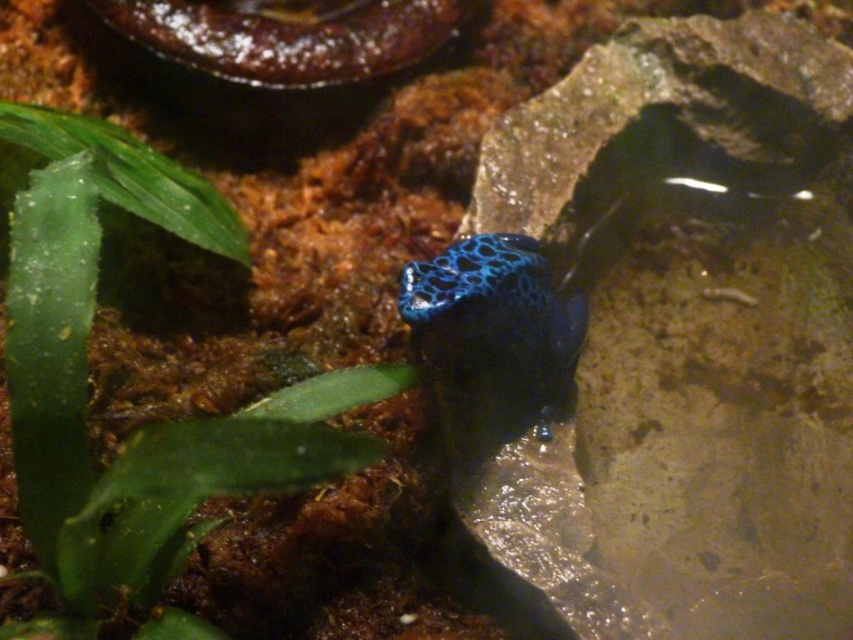
Does green leafy plant at upper left appear on the right side of blue glossy frog at center?

In fact, green leafy plant at upper left is to the left of blue glossy frog at center.

Is green leafy plant at upper left thinner than blue glossy frog at center?

Incorrect, green leafy plant at upper left's width is not less than blue glossy frog at center's.

What do you see at coordinates (86, 380) in the screenshot? The width and height of the screenshot is (853, 640). I see `green leafy plant at upper left` at bounding box center [86, 380].

This screenshot has height=640, width=853. What are the coordinates of `green leafy plant at upper left` in the screenshot? It's located at (86, 380).